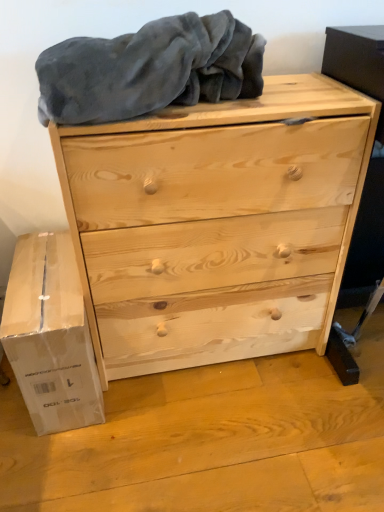
Locate an element on the screen. This screenshot has width=384, height=512. empty space that is ontop of white cardboard box at lower left (from a real-world perspective) is located at coordinates (40, 269).